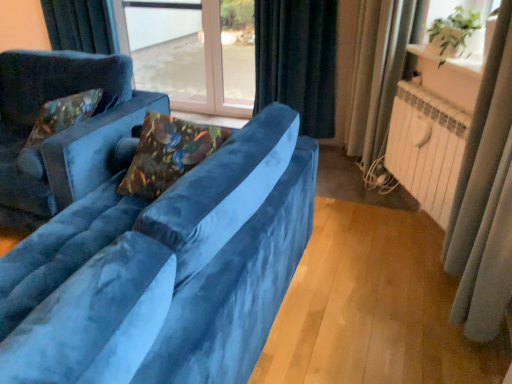
This screenshot has width=512, height=384. I want to click on vacant space to the left of silky gray curtain at right, the third curtain viewed from the back, so click(x=418, y=332).